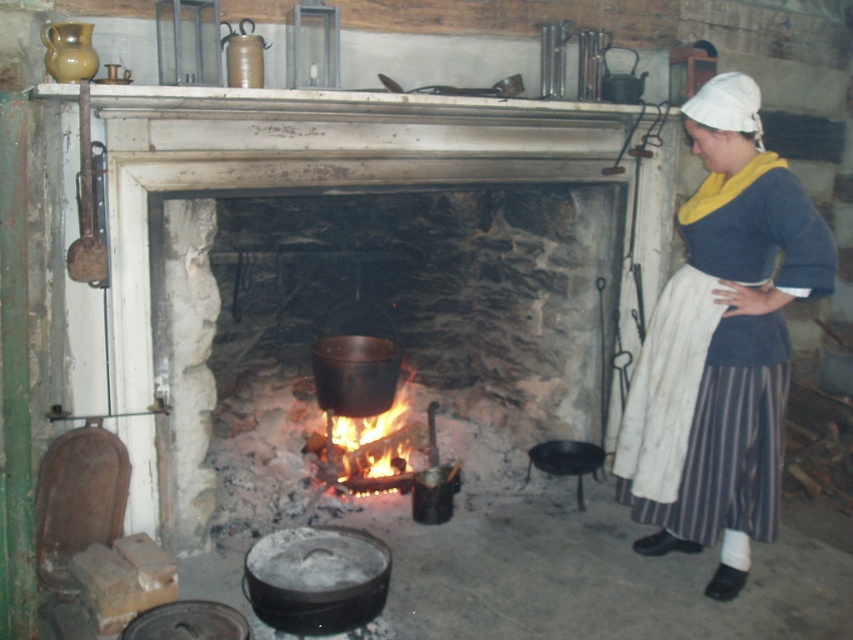
You are standing in the rustic indoor setting depicted in the scene. You notice the matte gray skirt at right. Can you estimate its position relative to the center of the image?

The matte gray skirt at right is located at coordinates approximately 0.539 on the x axis and 0.848 on the y axis, so it is positioned to the right and slightly below the center of the image.

You are a guest in this rustic kitchen and want to place a decorative item on the mantel. The matte gray skirt at right is already there. Where should you place the new item if you want it to be to the right of the black cast iron pot at center?

Place the new item to the right of the black cast iron pot at center but still to the left of the matte gray skirt at right since the black cast iron pot at center is already positioned to the left of the matte gray skirt at right.